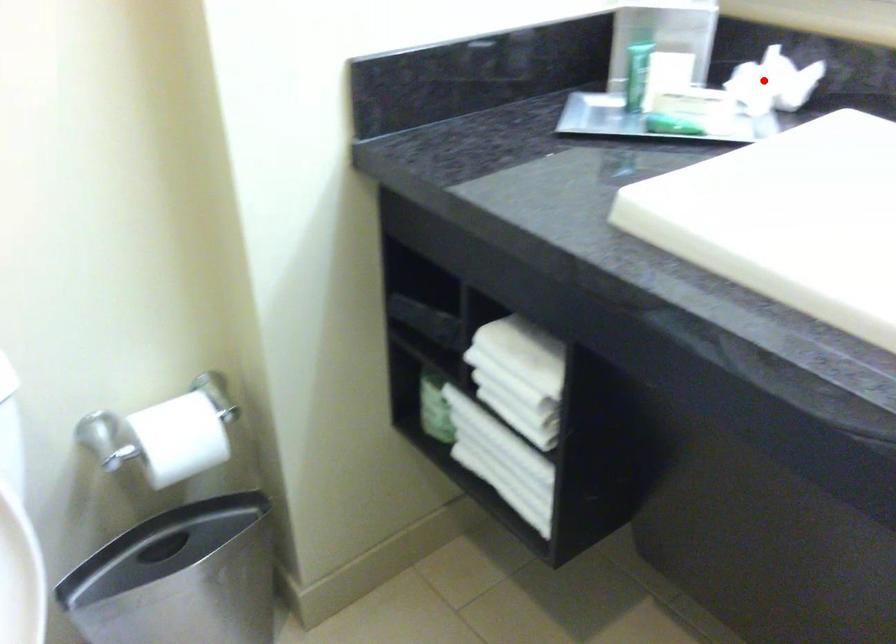
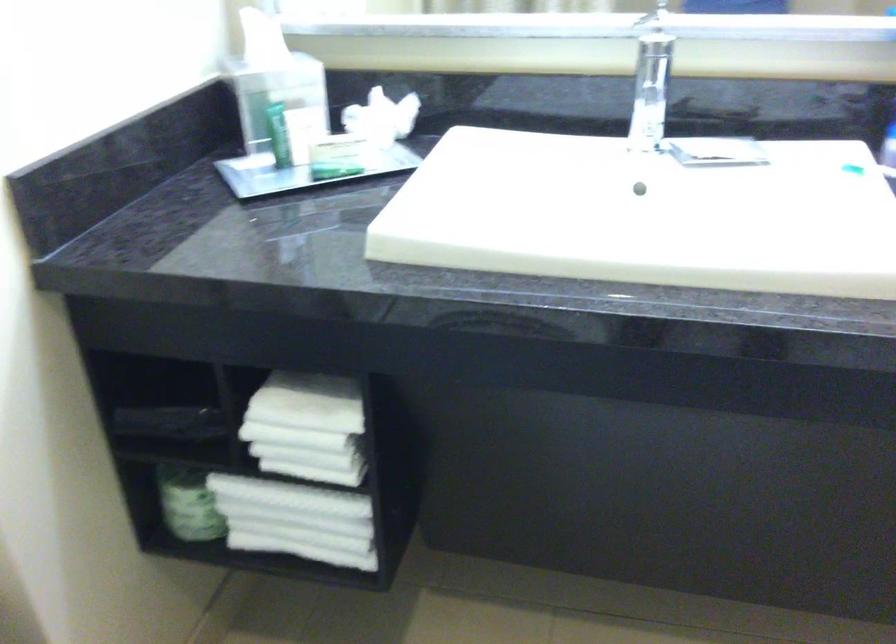
Find the pixel in the second image that matches the highlighted location in the first image.

(382, 118)